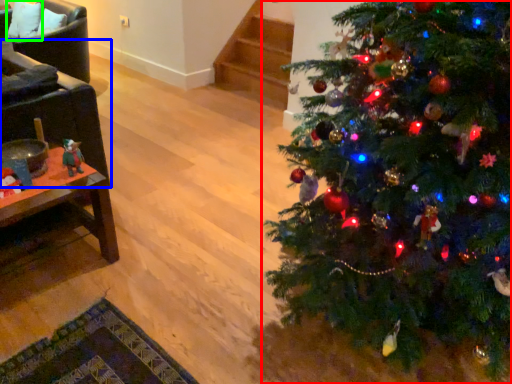
Question: Based on their relative distances, which object is nearer to christmas tree (highlighted by a red box)? Choose from armchair (highlighted by a blue box) and pillow (highlighted by a green box).

Choices:
 (A) armchair
 (B) pillow

Answer: (A)